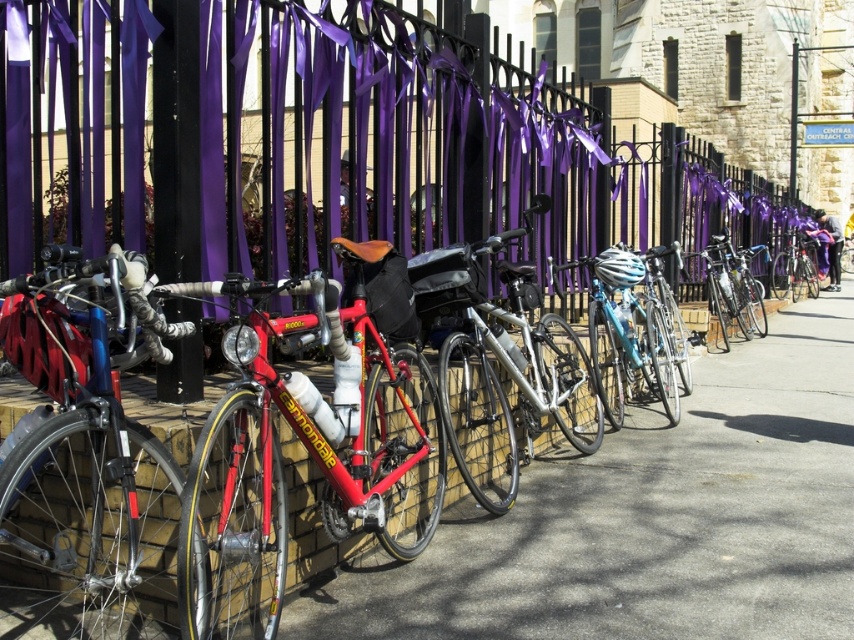
You are a delivery person who needs to park your shiny blue bicycle at left on the smooth concrete pavement at center. Can you fit your bicycle on the pavement?

The smooth concrete pavement at center is bigger than the shiny blue bicycle at left, so yes, the bicycle can fit on the pavement.

You are a delivery person who needs to park your shiny blue bicycle at left. The smooth concrete pavement at center is where you want to park it. Can you move the bicycle onto the pavement?

The shiny blue bicycle at left is behind the smooth concrete pavement at center, so you can move it forward to park on the pavement.

You are a delivery person who needs to park your delivery cart. You see the shiny blue bicycle at center and the smooth concrete pavement at center. Where should you park your cart to ensure it is on the pavement and not blocking the bicycle?

You should park your cart on the smooth concrete pavement at center to the right of the shiny blue bicycle at center to ensure it is on the pavement and not blocking the bicycle.